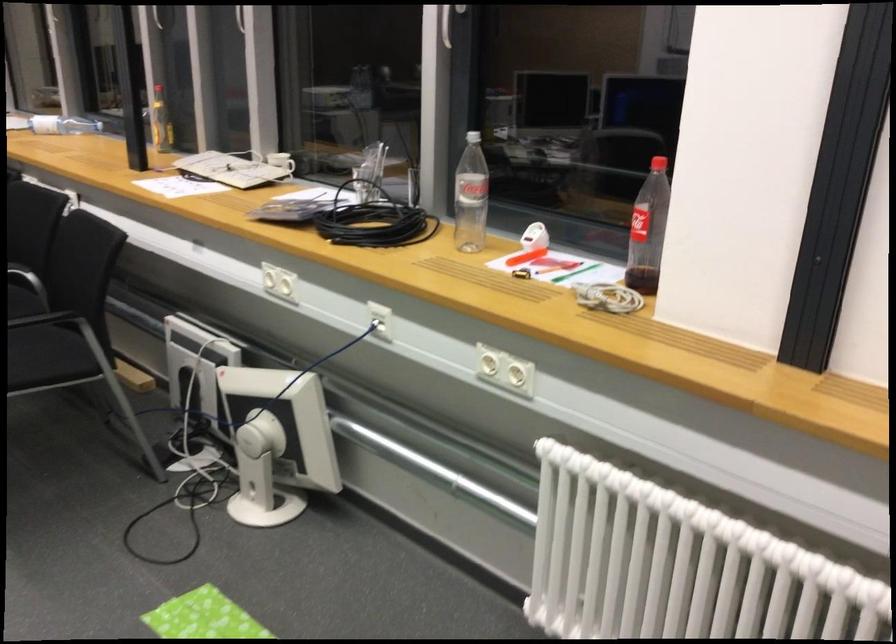
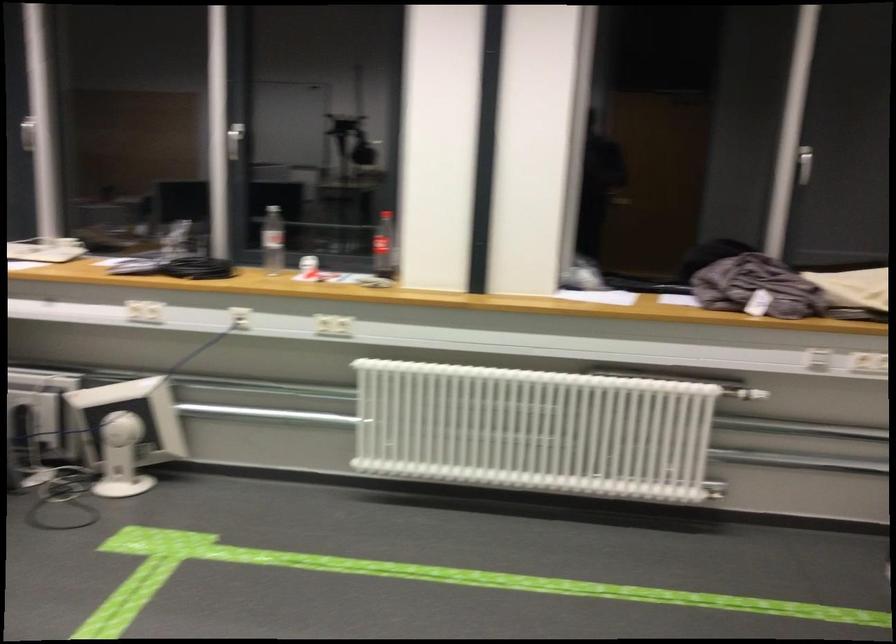
In the second image, find the point that corresponds to point 464,182 in the first image.

(271, 240)